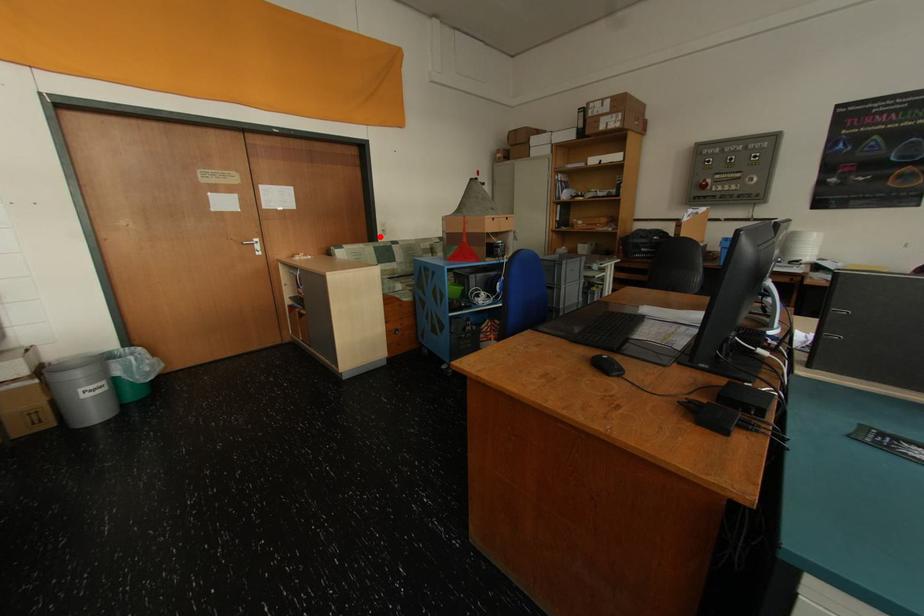
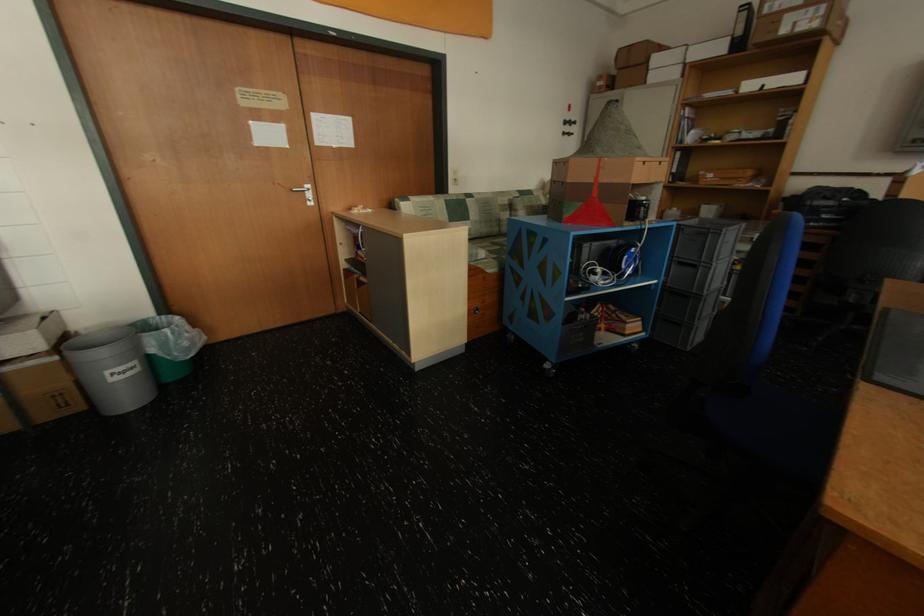
In the second image, find the point that corresponds to the highlighted location in the first image.

(448, 187)